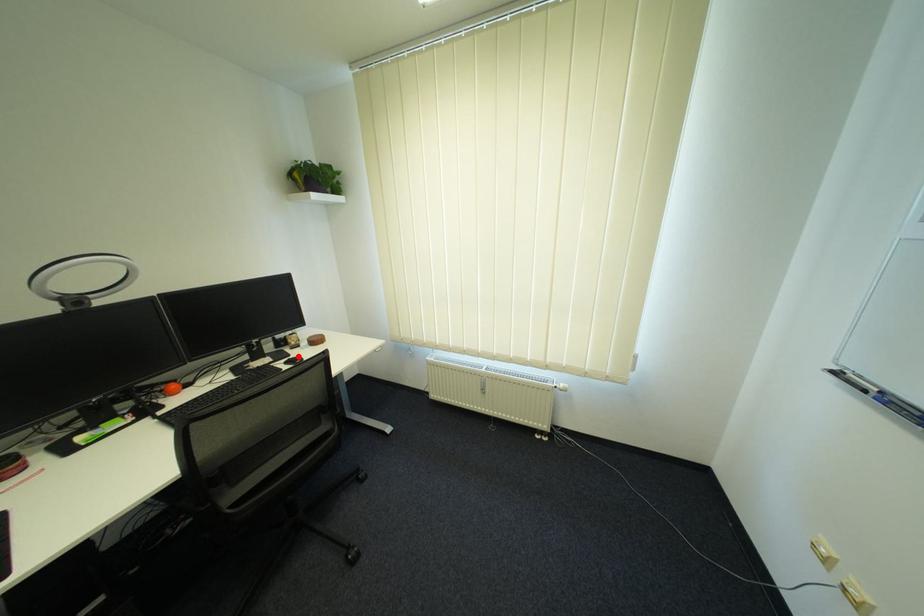
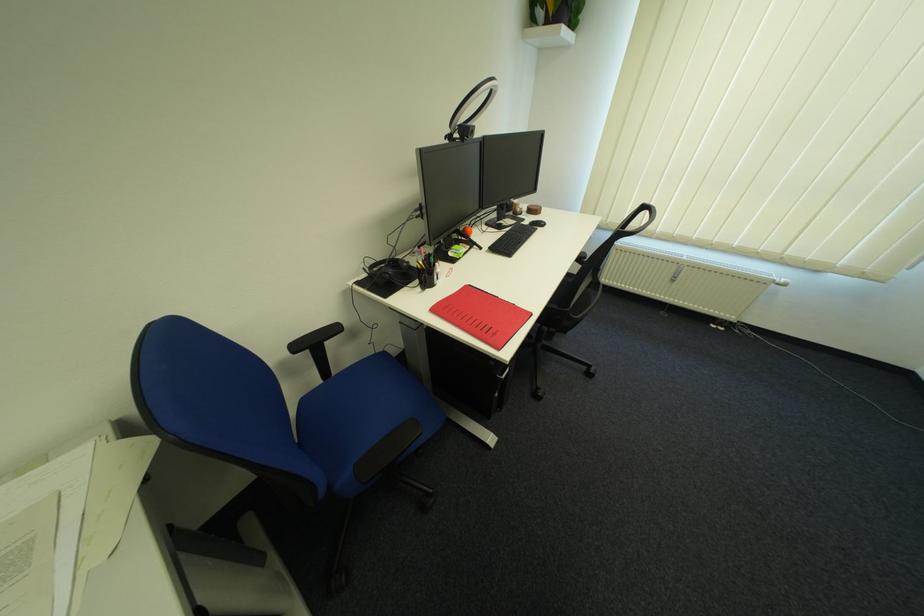
In the second image, find the point that corresponds to the highlighted location in the first image.

(532, 221)